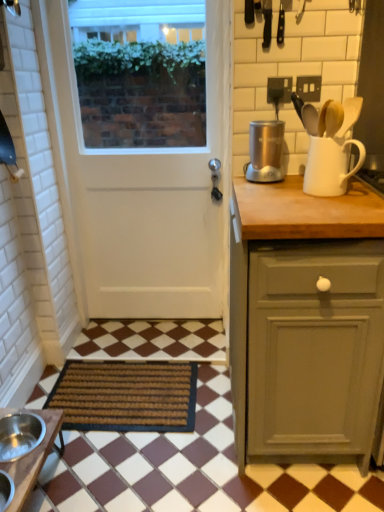
At what (x,y) coordinates should I click in order to perform the action: click on free point in front of white matte jug at upper right. Please return your answer as a coordinate pair (x, y). This screenshot has height=512, width=384. Looking at the image, I should click on (331, 202).